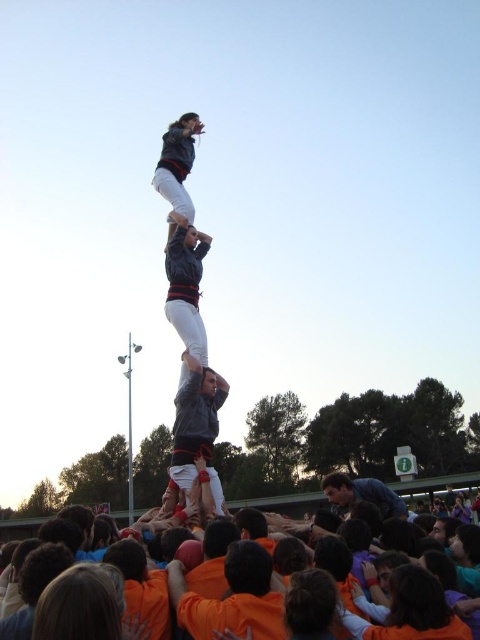
Question: Does matte gray jacket at center appear under blue denim shirt at center?

Choices:
 (A) yes
 (B) no

Answer: (B)

Question: Which is farther from the orange cotton shirt at lower center?

Choices:
 (A) orange cotton crowd at lower center
 (B) blue denim shirt at center
 (C) matte gray jacket at center

Answer: (C)

Question: Does orange cotton shirt at lower center have a lesser width compared to matte gray jacket at center?

Choices:
 (A) no
 (B) yes

Answer: (A)

Question: Is orange cotton crowd at lower center smaller than blue denim shirt at center?

Choices:
 (A) yes
 (B) no

Answer: (B)

Question: Which of the following is the closest to the observer?

Choices:
 (A) blue denim shirt at center
 (B) matte gray jacket at center
 (C) orange cotton crowd at lower center
 (D) orange cotton shirt at lower center

Answer: (D)

Question: Which point is closer to the camera?

Choices:
 (A) (176, 189)
 (B) (257, 604)
 (C) (340, 500)
 (D) (333, 483)

Answer: (B)